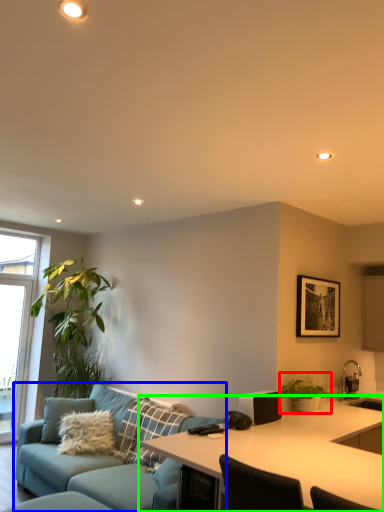
Question: Based on their relative distances, which object is nearer to houseplant (highlighted by a red box)? Choose from studio couch (highlighted by a blue box) and desk (highlighted by a green box).

Choices:
 (A) studio couch
 (B) desk

Answer: (B)